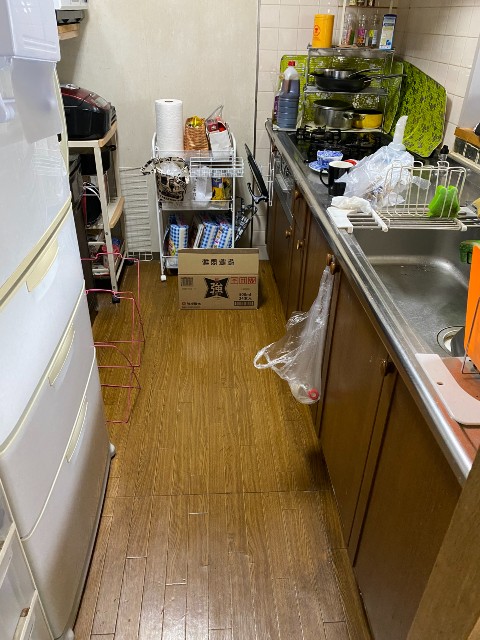
Locate an element on the screen. Image resolution: width=480 pixels, height=640 pixels. trash bag is located at coordinates (298, 369).